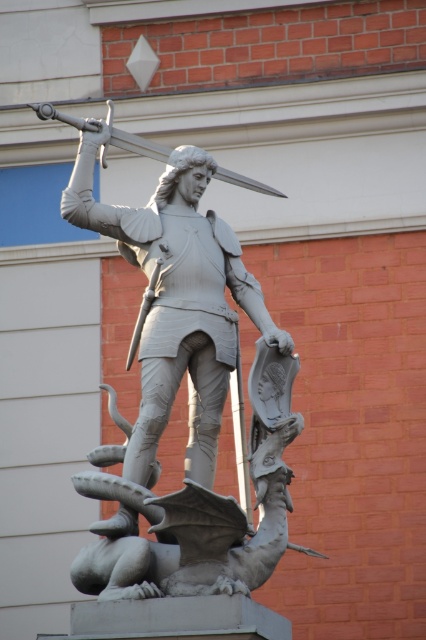
Question: Is gray stone statue at center positioned before polished silver sword at upper center?

Choices:
 (A) no
 (B) yes

Answer: (B)

Question: Which object appears farthest from the camera in this image?

Choices:
 (A) polished silver sword at upper center
 (B) gray stone statue at center

Answer: (A)

Question: Which point is farther from the camera taking this photo?

Choices:
 (A) (108, 106)
 (B) (175, 256)

Answer: (A)

Question: From the image, what is the correct spatial relationship of gray stone statue at center in relation to polished silver sword at upper center?

Choices:
 (A) right
 (B) left

Answer: (A)

Question: Which of the following is the closest to the observer?

Choices:
 (A) (213, 532)
 (B) (154, 141)

Answer: (A)

Question: In this image, where is gray stone statue at center located relative to polished silver sword at upper center?

Choices:
 (A) right
 (B) left

Answer: (A)